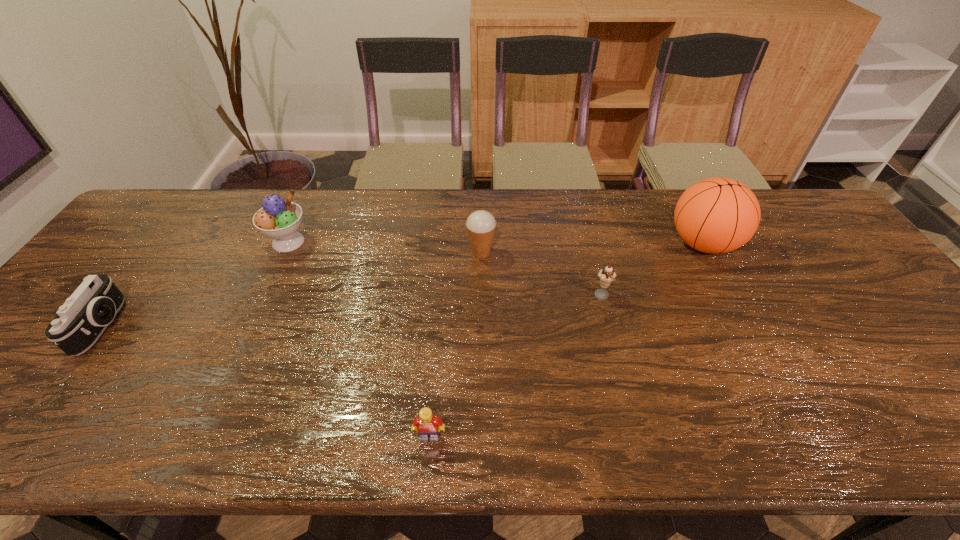
Identify the location of unoccupied position between the second icecream from right to left and the camera. (293, 289).

Image resolution: width=960 pixels, height=540 pixels. Identify the location of vacant area between the shortest icecream and the third object from left to right. (516, 367).

Identify the location of object that is the fifth closest to the nearest icecream. This screenshot has height=540, width=960. (80, 321).

At what (x,y) coordinates should I click in order to perform the action: click on the closest object relative to the basketball. Please return your answer as a coordinate pair (x, y). This screenshot has height=540, width=960. Looking at the image, I should click on (606, 276).

The image size is (960, 540). In order to click on icecream that stands as the second closest to the Lego in this screenshot , I will do `click(481, 225)`.

The image size is (960, 540). I want to click on the second closest icecream to the camera, so click(x=481, y=225).